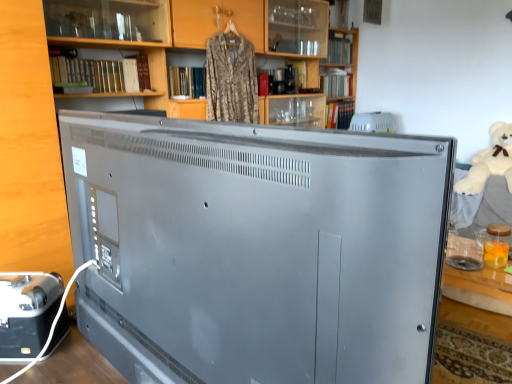
Question: Is white plush bear at right thinner than matte wood bookcase at upper center?

Choices:
 (A) no
 (B) yes

Answer: (A)

Question: Is white plush bear at right located outside matte wood bookcase at upper center?

Choices:
 (A) yes
 (B) no

Answer: (A)

Question: Considering the relative positions of white plush bear at right and matte wood bookcase at upper center in the image provided, is white plush bear at right to the left of matte wood bookcase at upper center from the viewer's perspective?

Choices:
 (A) yes
 (B) no

Answer: (B)

Question: Does white plush bear at right have a smaller size compared to matte wood bookcase at upper center?

Choices:
 (A) yes
 (B) no

Answer: (A)

Question: Does white plush bear at right come behind matte wood bookcase at upper center?

Choices:
 (A) yes
 (B) no

Answer: (A)

Question: Does point (509, 134) appear closer or farther from the camera than point (390, 292)?

Choices:
 (A) farther
 (B) closer

Answer: (A)

Question: From the image's perspective, relative to satin gray television at center, is white plush bear at right above or below?

Choices:
 (A) below
 (B) above

Answer: (B)

Question: In terms of height, does white plush bear at right look taller or shorter compared to satin gray television at center?

Choices:
 (A) short
 (B) tall

Answer: (A)

Question: Is white plush bear at right to the left or to the right of satin gray television at center in the image?

Choices:
 (A) left
 (B) right

Answer: (B)

Question: Is satin gray television at center inside or outside of matte wood bookcase at upper center?

Choices:
 (A) inside
 (B) outside

Answer: (B)

Question: Considering the positions of satin gray television at center and matte wood bookcase at upper center in the image, is satin gray television at center wider or thinner than matte wood bookcase at upper center?

Choices:
 (A) thin
 (B) wide

Answer: (A)

Question: Is satin gray television at center bigger or smaller than matte wood bookcase at upper center?

Choices:
 (A) big
 (B) small

Answer: (B)

Question: From the image's perspective, is satin gray television at center positioned above or below matte wood bookcase at upper center?

Choices:
 (A) below
 (B) above

Answer: (A)

Question: From the image's perspective, is matte wood bookcase at upper center above or below metallic silver toaster at lower left, the 1th appliance in the bottom-to-top sequence?

Choices:
 (A) below
 (B) above

Answer: (B)

Question: Would you say matte wood bookcase at upper center is to the left or to the right of metallic silver toaster at lower left, which is the first appliance from front to back, in the picture?

Choices:
 (A) left
 (B) right

Answer: (B)